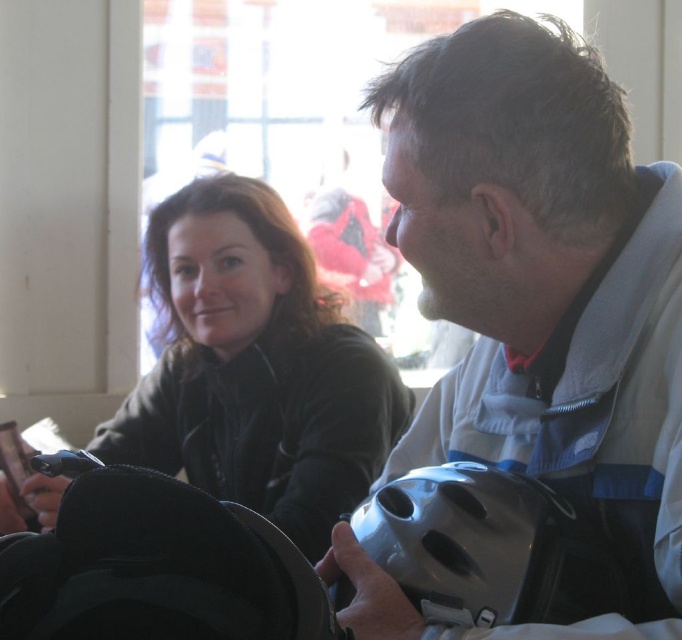
Consider the image. You are organizing a photo shoot and need to ensure that the matte black jacket at center and the black fabric helmet at lower left are visible in the frame. Since the jacket is covering part of the helmet, how can you adjust the camera angle to show both items clearly without moving either object?

Since the matte black jacket at center is positioned over the black fabric helmet at lower left, you can tilt the camera upwards slightly to angle the shot so that the jacket moves out of the way, revealing the helmet underneath. This adjustment will allow both items to be visible in the frame without moving them.

You are a photographer setting up a shoot in this indoor scene. You need to position a light source so it illuminates both the matte black jacket at center and the matte gray helmet at lower right without creating harsh shadows. Considering their sizes, which object should you place closer to the light source to ensure even lighting?

The matte black jacket at center is taller than the matte gray helmet at lower right, so to ensure even lighting, the matte gray helmet at lower right should be placed closer to the light source since it is shorter and requires less light to achieve the same illumination level as the taller jacket.